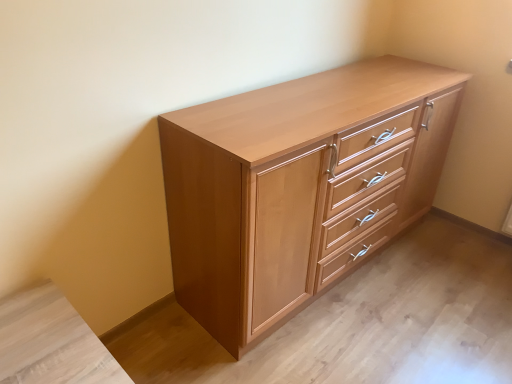
What do you see at coordinates (51, 342) in the screenshot? The image size is (512, 384). I see `light brown wood vanity at lower left` at bounding box center [51, 342].

What is the approximate height of light brown wood vanity at lower left?

light brown wood vanity at lower left is 17.48 inches in height.

Where is `light brown wood vanity at lower left`? light brown wood vanity at lower left is located at coordinates (51, 342).

The width and height of the screenshot is (512, 384). In order to click on light brown wood chest of drawers at center in this screenshot , I will do coord(298,186).

The height and width of the screenshot is (384, 512). Describe the element at coordinates (298, 186) in the screenshot. I see `light brown wood chest of drawers at center` at that location.

Identify the location of light brown wood vanity at lower left. (51, 342).

Consider the image. Between light brown wood vanity at lower left and light brown wood chest of drawers at center, which one appears on the right side from the viewer's perspective?

From the viewer's perspective, light brown wood chest of drawers at center appears more on the right side.

Is the position of light brown wood vanity at lower left more distant than that of light brown wood chest of drawers at center?

No, light brown wood vanity at lower left is closer to the camera.

Which is closer to the camera, (74, 351) or (225, 255)?

The point (74, 351) is more forward.

From the image's perspective, is light brown wood vanity at lower left above light brown wood chest of drawers at center?

Actually, light brown wood vanity at lower left appears below light brown wood chest of drawers at center in the image.

From a real-world perspective, is light brown wood vanity at lower left above or below light brown wood chest of drawers at center?

From a real-world perspective, light brown wood vanity at lower left is physically below light brown wood chest of drawers at center.

Which object is thinner, light brown wood vanity at lower left or light brown wood chest of drawers at center?

Thinner between the two is light brown wood vanity at lower left.

From the picture: Considering the sizes of light brown wood vanity at lower left and light brown wood chest of drawers at center in the image, is light brown wood vanity at lower left taller or shorter than light brown wood chest of drawers at center?

In the image, light brown wood vanity at lower left appears to be shorter than light brown wood chest of drawers at center.

Between light brown wood vanity at lower left and light brown wood chest of drawers at center, which one has smaller size?

With smaller size is light brown wood vanity at lower left.

Is light brown wood chest of drawers at center located within light brown wood vanity at lower left?

No, light brown wood chest of drawers at center is located outside of light brown wood vanity at lower left.

Would you consider light brown wood vanity at lower left to be distant from light brown wood chest of drawers at center?

That's not correct — light brown wood vanity at lower left is a little close to light brown wood chest of drawers at center.

Does light brown wood vanity at lower left turn towards light brown wood chest of drawers at center?

No, light brown wood vanity at lower left is not oriented towards light brown wood chest of drawers at center.

What's the angular difference between light brown wood vanity at lower left and light brown wood chest of drawers at center's facing directions?

The facing directions of light brown wood vanity at lower left and light brown wood chest of drawers at center are 0.24 degrees apart.

Image resolution: width=512 pixels, height=384 pixels. In order to click on vanity that appears below the light brown wood chest of drawers at center (from a real-world perspective) in this screenshot , I will do `click(51, 342)`.

Is light brown wood chest of drawers at center to the left of light brown wood vanity at lower left from the viewer's perspective?

In fact, light brown wood chest of drawers at center is to the right of light brown wood vanity at lower left.

Considering their positions, is light brown wood chest of drawers at center located in front of or behind light brown wood vanity at lower left?

Visually, light brown wood chest of drawers at center is located behind light brown wood vanity at lower left.

Does point (249, 233) lie in front of point (64, 380)?

No, (249, 233) is behind (64, 380).

From the image's perspective, which is above, light brown wood chest of drawers at center or light brown wood vanity at lower left?

light brown wood chest of drawers at center, from the image's perspective.

From a real-world perspective, between light brown wood chest of drawers at center and light brown wood vanity at lower left, who is vertically higher?

In real-world perspective, light brown wood chest of drawers at center is above.

Is light brown wood chest of drawers at center thinner than light brown wood vanity at lower left?

No, light brown wood chest of drawers at center is not thinner than light brown wood vanity at lower left.

Considering the sizes of objects light brown wood chest of drawers at center and light brown wood vanity at lower left in the image provided, who is shorter, light brown wood chest of drawers at center or light brown wood vanity at lower left?

Standing shorter between the two is light brown wood vanity at lower left.

Considering the sizes of objects light brown wood chest of drawers at center and light brown wood vanity at lower left in the image provided, who is smaller, light brown wood chest of drawers at center or light brown wood vanity at lower left?

light brown wood vanity at lower left is smaller.

Which is correct: light brown wood chest of drawers at center is inside light brown wood vanity at lower left, or outside of it?

The correct answer is: outside.

Is light brown wood chest of drawers at center not close to light brown wood vanity at lower left?

No, light brown wood chest of drawers at center is not far away from light brown wood vanity at lower left.

Is light brown wood chest of drawers at center facing away from light brown wood vanity at lower left?

light brown wood chest of drawers at center does not have its back to light brown wood vanity at lower left.

Find the location of a particular element. This screenshot has height=384, width=512. chest of drawers on the right of the light brown wood vanity at lower left is located at coordinates (298, 186).

This screenshot has width=512, height=384. Identify the location of vanity to the left of light brown wood chest of drawers at center. (51, 342).

Identify the location of the chest of drawers that is above the light brown wood vanity at lower left (from a real-world perspective). Image resolution: width=512 pixels, height=384 pixels. (298, 186).